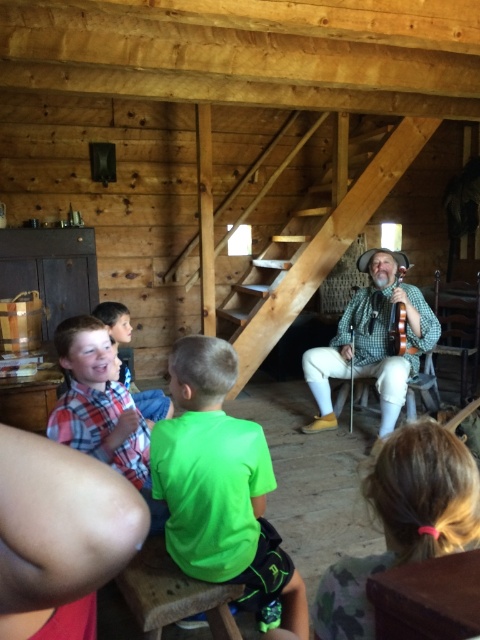
You are standing at the entrance of the rustic wooden cabin and see the point at coordinates (220, 484). What object is located exactly at that point?

The green fabric shirt at center is located exactly at point (220, 484).

You are a photographer standing in the cabin and want to take a photo of the plaid cotton shirt at lower left. There is a camera in the scene. Can you reach the camera from where you are standing without moving your feet?

The plaid cotton shirt at lower left and camera are 5.60 feet apart from each other. Since the photographer is standing in the cabin and the camera is 5.60 feet away, they can likely reach it without moving their feet if their arm span allows, but the question doesn not specify arm length. However, based on the distance provided, the camera is within a reasonable reach.